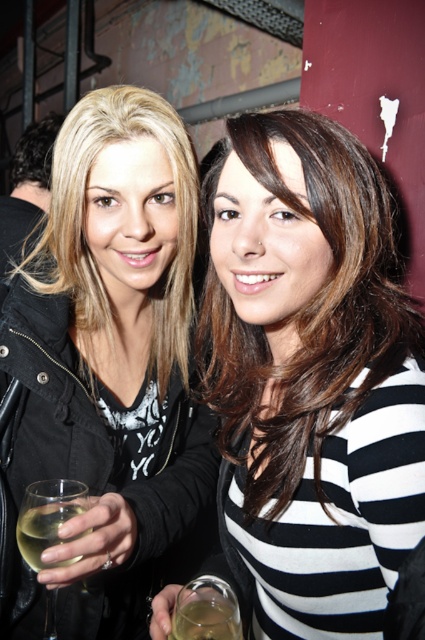
You are a photographer trying to capture a clear shot of the dark brown hair at upper left without the matte black jacket at center blocking it. Based on the scene, is this possible?

The matte black jacket at center is in front of the dark brown hair at upper left, so it is blocking the view. To capture a clear shot of the dark brown hair at upper left, you would need to adjust your angle or position to move around the matte black jacket at center.

You are standing in front of a photo of two people at a social event. The photo has a coordinate system where the bottom left corner is the origin. The matte black jacket at center is marked by the point with coordinates point (110,356). If you want to place a sticker exactly at the location of the matte black jacket at center, what are the coordinates you should use?

The coordinates for the matte black jacket at center are point (110,356), so you should place the sticker at point (110,356).

You are a photographer at a social event and need to ensure that both the matte black jacket at center and the translucent glass wine at center are clearly visible in your photo. Given their sizes, which object should you focus on first to ensure proper exposure?

The matte black jacket at center is larger in size than the translucent glass wine at center, so you should focus on the matte black jacket at center first to ensure proper exposure.